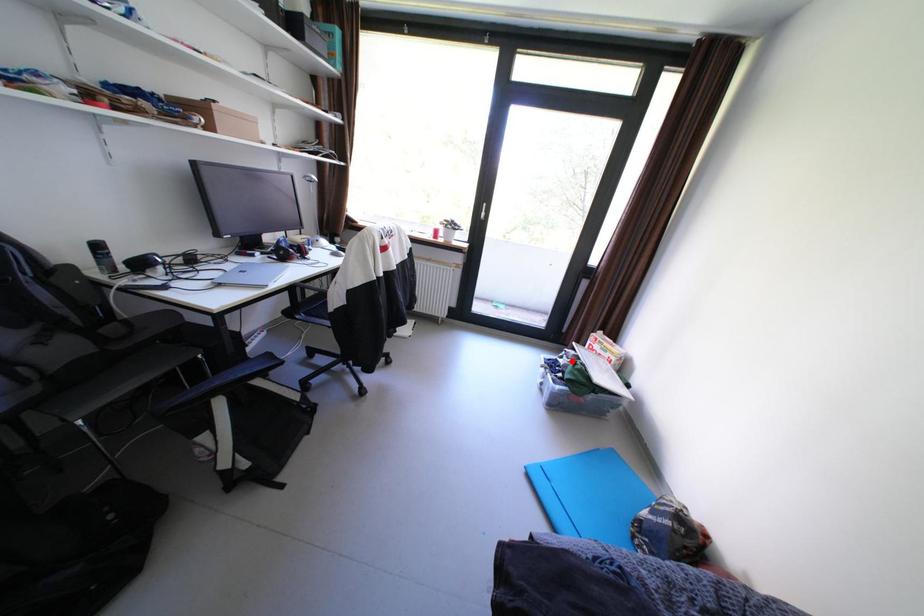
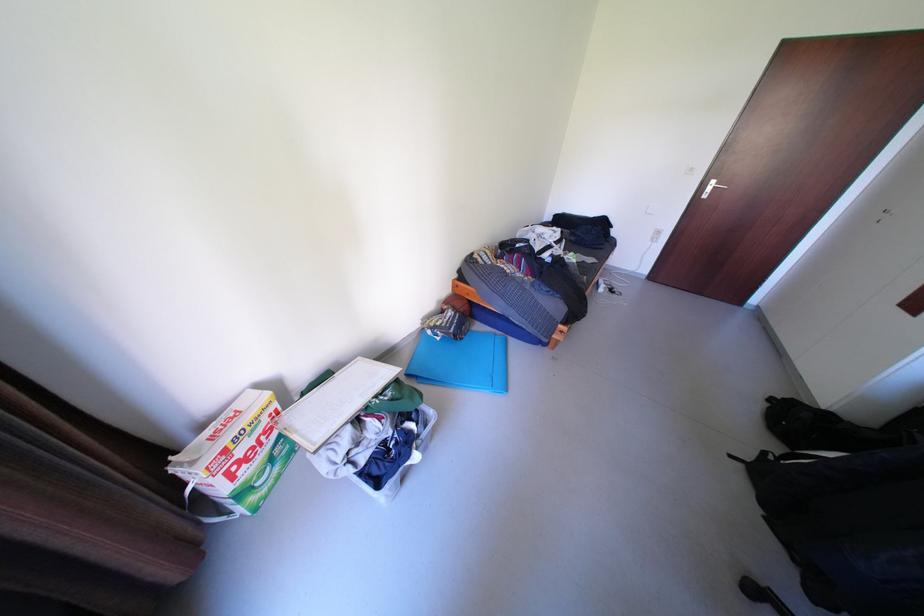
Question: I am providing you with two images of the same scene from different viewpoints. A red point is shown in image1. For the corresponding object point in image2, is it positioned nearer or farther from the camera?

Choices:
 (A) Nearer
 (B) Farther

Answer: (B)